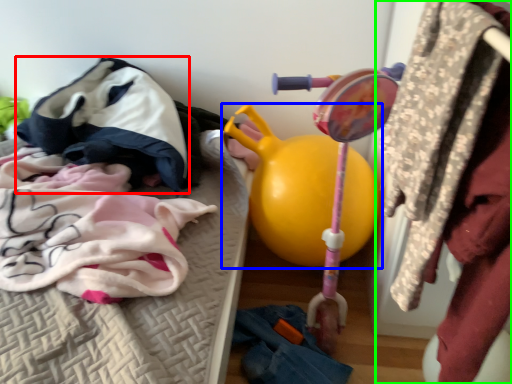
Question: Considering the real-world distances, which object is closest to clothing (highlighted by a red box)? toy (highlighted by a blue box) or closet (highlighted by a green box).

Choices:
 (A) toy
 (B) closet

Answer: (A)